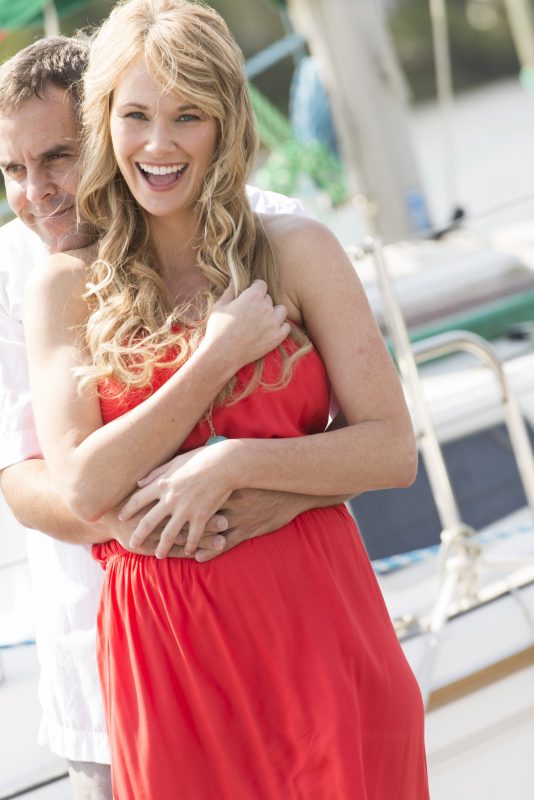
Identify the location of metal rounded railing. The width and height of the screenshot is (534, 800). (458, 338).